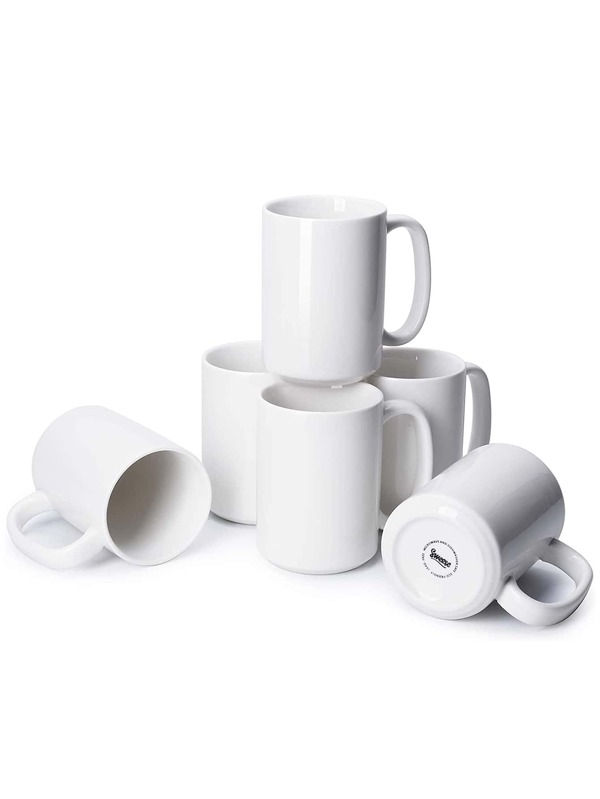
This screenshot has height=799, width=600. I want to click on mug handle, so tap(34, 557), tap(562, 607), tap(403, 407), tap(485, 398), tap(426, 293).